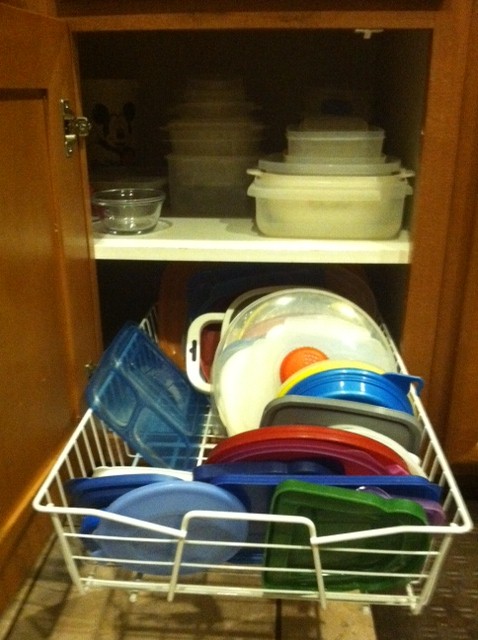
Identify the location of hinge. (74, 131), (88, 377).